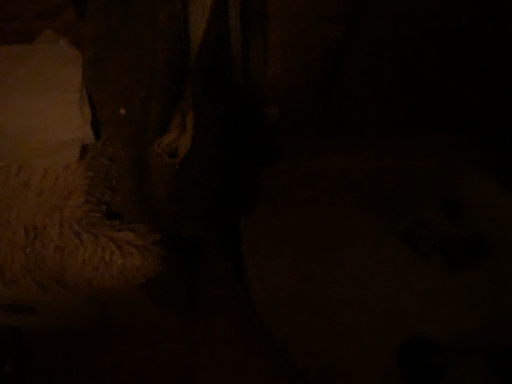
This screenshot has width=512, height=384. What do you see at coordinates (59, 184) in the screenshot?
I see `fuzzy fabric cat at left` at bounding box center [59, 184].

Image resolution: width=512 pixels, height=384 pixels. I want to click on fuzzy fabric cat at left, so pos(59,184).

At what (x,y) coordinates should I click in order to perform the action: click on fuzzy fabric cat at left. Please return your answer as a coordinate pair (x, y). The width and height of the screenshot is (512, 384). Looking at the image, I should click on (59, 184).